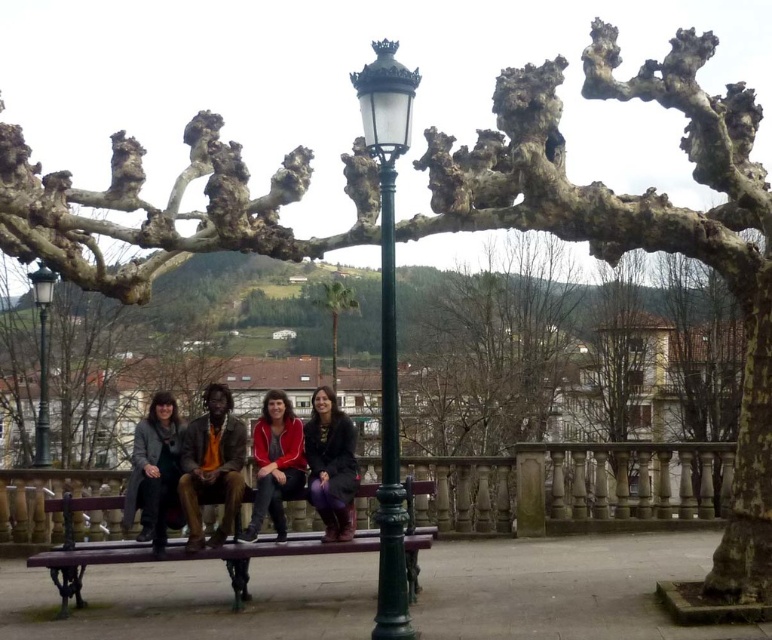
Question: Can you confirm if wooden bench at center is positioned above dark gray coat at left?

Choices:
 (A) yes
 (B) no

Answer: (B)

Question: Is green metal street light at center thinner than green metal pole at center?

Choices:
 (A) yes
 (B) no

Answer: (A)

Question: Which point is closer to the camera?

Choices:
 (A) (222, 412)
 (B) (254, 532)

Answer: (B)

Question: Does green metal pole at center have a greater width compared to matte black jacket at center?

Choices:
 (A) no
 (B) yes

Answer: (B)

Question: Based on their relative distances, which object is farther from the wooden bench at center?

Choices:
 (A) brown leather jacket at center
 (B) green metal pole at center

Answer: (B)

Question: Estimate the real-world distances between objects in this image. Which object is closer to the dark gray coat at left?

Choices:
 (A) green leafy palm tree at center
 (B) green metal street light at left

Answer: (B)